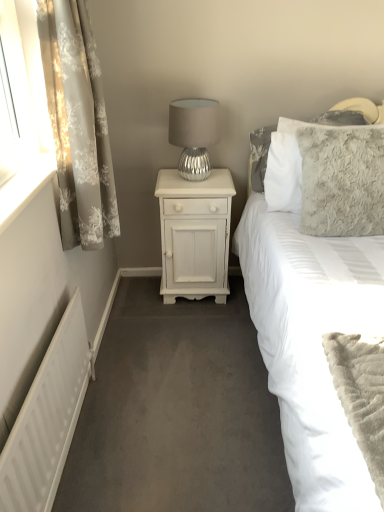
Question: Is fluffy gray pillow at upper right completely or partially outside of fluffy gray pillow at upper right?

Choices:
 (A) no
 (B) yes

Answer: (A)

Question: Is fluffy gray pillow at upper right not close to fluffy gray pillow at upper right?

Choices:
 (A) yes
 (B) no

Answer: (B)

Question: Can you confirm if fluffy gray pillow at upper right is wider than fluffy gray pillow at upper right?

Choices:
 (A) no
 (B) yes

Answer: (A)

Question: Considering the relative sizes of fluffy gray pillow at upper right and fluffy gray pillow at upper right in the image provided, is fluffy gray pillow at upper right smaller than fluffy gray pillow at upper right?

Choices:
 (A) yes
 (B) no

Answer: (A)

Question: From the image's perspective, is fluffy gray pillow at upper right on fluffy gray pillow at upper right?

Choices:
 (A) yes
 (B) no

Answer: (A)

Question: Visually, is white matte radiator at lower left positioned to the left or to the right of white painted wood nightstand at center?

Choices:
 (A) right
 (B) left

Answer: (B)

Question: Considering the positions of point (43, 423) and point (201, 282), is point (43, 423) closer or farther from the camera than point (201, 282)?

Choices:
 (A) farther
 (B) closer

Answer: (B)

Question: Is white matte radiator at lower left situated inside white painted wood nightstand at center or outside?

Choices:
 (A) inside
 (B) outside

Answer: (B)

Question: In the image, is white matte radiator at lower left positioned in front of or behind white painted wood nightstand at center?

Choices:
 (A) behind
 (B) front

Answer: (B)

Question: Choose the correct answer: Is fluffy gray pillow at upper right inside silver metallic table lamp at upper center or outside it?

Choices:
 (A) inside
 (B) outside

Answer: (B)

Question: Considering the positions of point (314, 264) and point (196, 97), is point (314, 264) closer or farther from the camera than point (196, 97)?

Choices:
 (A) closer
 (B) farther

Answer: (A)

Question: Relative to silver metallic table lamp at upper center, is fluffy gray pillow at upper right in front or behind?

Choices:
 (A) behind
 (B) front

Answer: (B)

Question: Is fluffy gray pillow at upper right wider or thinner than silver metallic table lamp at upper center?

Choices:
 (A) thin
 (B) wide

Answer: (B)

Question: Considering the positions of point (355, 502) and point (208, 248), is point (355, 502) closer or farther from the camera than point (208, 248)?

Choices:
 (A) farther
 (B) closer

Answer: (B)

Question: In the image, is fluffy gray pillow at upper right on the left side or the right side of white painted wood nightstand at center?

Choices:
 (A) left
 (B) right

Answer: (B)